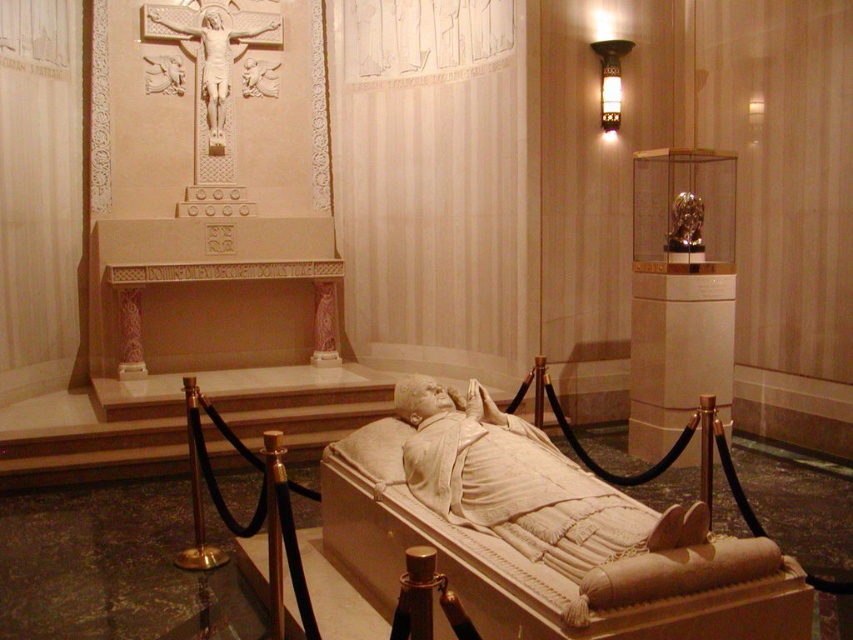
Does white marble statue at center appear over white marble crucifix at upper center?

Actually, white marble statue at center is below white marble crucifix at upper center.

How distant is white marble statue at center from white marble crucifix at upper center?

They are 5.20 meters apart.

Image resolution: width=853 pixels, height=640 pixels. Find the location of `white marble statue at center`. white marble statue at center is located at coordinates (558, 504).

This screenshot has width=853, height=640. In order to click on white marble statue at center in this screenshot , I will do `click(558, 504)`.

Is white marble statue at center smaller than gold metallic statue at upper right?

No, white marble statue at center is not smaller than gold metallic statue at upper right.

Does white marble statue at center have a greater width compared to gold metallic statue at upper right?

Indeed, white marble statue at center has a greater width compared to gold metallic statue at upper right.

Between point (624, 560) and point (680, 224), which one is positioned behind?

Positioned behind is point (680, 224).

The image size is (853, 640). Identify the location of white marble statue at center. (558, 504).

Is white marble crucifix at upper center bigger than gold metallic statue at upper right?

Yes, white marble crucifix at upper center is bigger than gold metallic statue at upper right.

Which is more to the right, white marble crucifix at upper center or gold metallic statue at upper right?

gold metallic statue at upper right is more to the right.

Measure the distance between white marble crucifix at upper center and camera.

white marble crucifix at upper center is 23.09 feet from camera.

Locate an element on the screen. white marble crucifix at upper center is located at coordinates (213, 60).